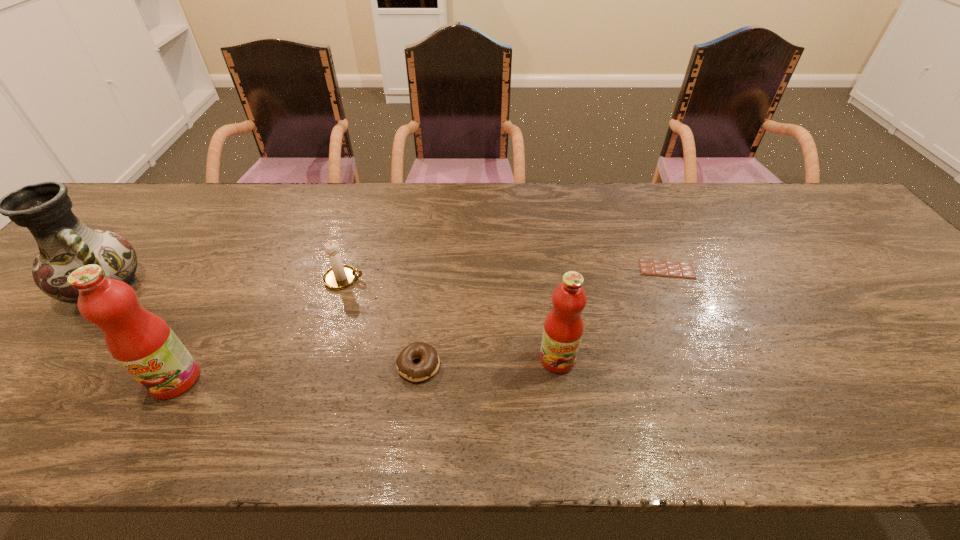
Find the location of `doughnut`. doughnut is located at coordinates (429, 364).

Find the location of a particular element. vacant space located on the back of the rightmost object is located at coordinates (633, 191).

You are a GUI agent. You are given a task and a screenshot of the screen. Output one action in this format:
    pyautogui.click(x=<x>, y=<y>)
    Task: Click on the vacant space located 0.200m on the handle side of the third object from left to right
    
    Given the screenshot: What is the action you would take?
    pyautogui.click(x=441, y=279)

At what (x,y) coordinates should I click in order to perform the action: click on blank space located on the right of the vase. Please return your answer as a coordinate pair (x, y). The image size is (960, 540). Looking at the image, I should click on (223, 287).

Identify the location of blank area located on the right of the fifth tallest object. This screenshot has width=960, height=540. (514, 366).

Image resolution: width=960 pixels, height=540 pixels. What are the coordinates of `doughnut located at the near edge` in the screenshot? It's located at (429, 364).

You are a GUI agent. You are given a task and a screenshot of the screen. Output one action in this format:
    pyautogui.click(x=<x>, y=<y>)
    Task: Click on the object present at the left edge
    This screenshot has height=540, width=960.
    Given the screenshot: What is the action you would take?
    pyautogui.click(x=65, y=243)

The image size is (960, 540). What are the coordinates of `vacant space at the far edge` in the screenshot? It's located at (495, 196).

The width and height of the screenshot is (960, 540). Find the location of `free space at the near edge of the desktop`. free space at the near edge of the desktop is located at coordinates (626, 391).

This screenshot has height=540, width=960. In order to click on blank space at the right edge of the desktop in this screenshot , I will do click(926, 313).